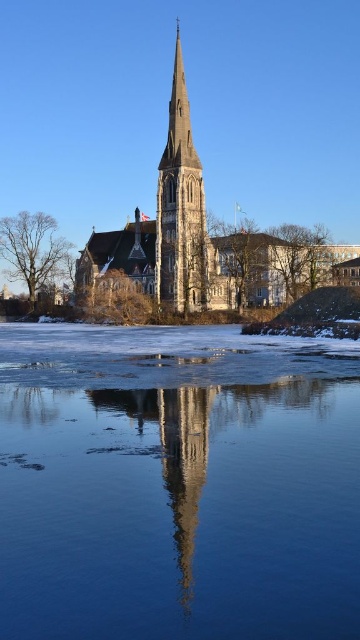
Can you confirm if transparent ice at lower center is wider than stone spire at center?

Yes.

Does transparent ice at lower center have a lesser width compared to stone spire at center?

No.

This screenshot has width=360, height=640. I want to click on transparent ice at lower center, so click(177, 483).

Is stone steeple at center further to the viewer compared to stone spire at center?

Yes, it is behind stone spire at center.

Does stone steeple at center have a smaller size compared to stone spire at center?

Incorrect, stone steeple at center is not smaller in size than stone spire at center.

Does point (257, 244) come closer to viewer compared to point (172, 166)?

No.

You are a GUI agent. You are given a task and a screenshot of the screen. Output one action in this format:
    pyautogui.click(x=<x>, y=<y>)
    Task: Click on the stone steeple at center
    
    Given the screenshot: What is the action you would take?
    pyautogui.click(x=203, y=240)

Is transparent ice at lower center above stone steeple at center?

No.

Does transparent ice at lower center have a larger size compared to stone steeple at center?

Incorrect, transparent ice at lower center is not larger than stone steeple at center.

In order to click on transparent ice at lower center in this screenshot , I will do `click(177, 483)`.